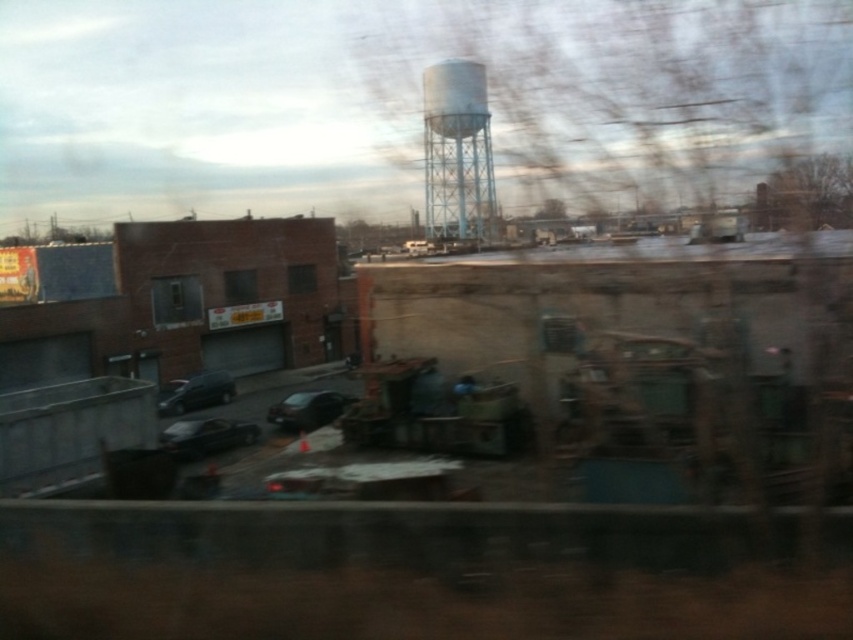
Question: Observing the image, what is the correct spatial positioning of shiny black car at lower left in reference to metallic gray train window at center?

Choices:
 (A) above
 (B) below

Answer: (B)

Question: Which object is farther from the camera taking this photo?

Choices:
 (A) shiny black sedan at center
 (B) metallic gray train window at center
 (C) shiny black car at center

Answer: (B)

Question: Can you confirm if shiny black car at center is positioned to the right of clear glass train window at center?

Choices:
 (A) no
 (B) yes

Answer: (B)

Question: Considering the relative positions of shiny black sedan at center and metallic gray train window at center in the image provided, where is shiny black sedan at center located with respect to metallic gray train window at center?

Choices:
 (A) left
 (B) right

Answer: (B)

Question: Estimate the real-world distances between objects in this image. Which object is closer to the metallic gray train window at center?

Choices:
 (A) white textured water tower at center
 (B) shiny black car at center
 (C) shiny black sedan at center
 (D) shiny black car at lower left

Answer: (D)

Question: Which of the following is the farthest from the observer?

Choices:
 (A) (451, 109)
 (B) (213, 442)
 (C) (231, 291)
 (D) (222, 394)

Answer: (C)